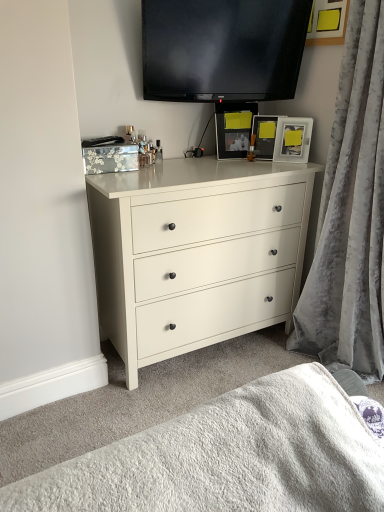
Question: Is white matte chest of drawers at center outside of matte silver picture frame at upper right, the first picture frame from the right?

Choices:
 (A) yes
 (B) no

Answer: (A)

Question: Are white matte chest of drawers at center and matte silver picture frame at upper right, the first picture frame from the right, making contact?

Choices:
 (A) yes
 (B) no

Answer: (B)

Question: From a real-world perspective, is white matte chest of drawers at center physically above matte silver picture frame at upper right, the first picture frame from the right?

Choices:
 (A) yes
 (B) no

Answer: (B)

Question: Does white matte chest of drawers at center come in front of matte silver picture frame at upper right, the second picture frame from the left?

Choices:
 (A) yes
 (B) no

Answer: (A)

Question: Considering the relative sizes of white matte chest of drawers at center and matte silver picture frame at upper right, the second picture frame from the left, in the image provided, is white matte chest of drawers at center shorter than matte silver picture frame at upper right, the second picture frame from the left,?

Choices:
 (A) no
 (B) yes

Answer: (A)

Question: Could you tell me if white matte chest of drawers at center is facing matte silver picture frame at upper right, the second picture frame from the left?

Choices:
 (A) yes
 (B) no

Answer: (B)

Question: Considering the relative sizes of velvet gray curtain at right and white matte chest of drawers at center in the image provided, is velvet gray curtain at right wider than white matte chest of drawers at center?

Choices:
 (A) yes
 (B) no

Answer: (B)

Question: Is white matte chest of drawers at center completely or partially inside velvet gray curtain at right?

Choices:
 (A) no
 (B) yes

Answer: (A)

Question: Is velvet gray curtain at right positioned far away from white matte chest of drawers at center?

Choices:
 (A) yes
 (B) no

Answer: (B)

Question: Is velvet gray curtain at right turned away from white matte chest of drawers at center?

Choices:
 (A) no
 (B) yes

Answer: (A)

Question: Is velvet gray curtain at right smaller than white matte chest of drawers at center?

Choices:
 (A) no
 (B) yes

Answer: (B)

Question: Does velvet gray curtain at right have a larger size compared to white matte chest of drawers at center?

Choices:
 (A) no
 (B) yes

Answer: (A)

Question: Are matte silver picture frame at upper right, the second picture frame from the left, and white textured blanket at lower center far apart?

Choices:
 (A) yes
 (B) no

Answer: (A)